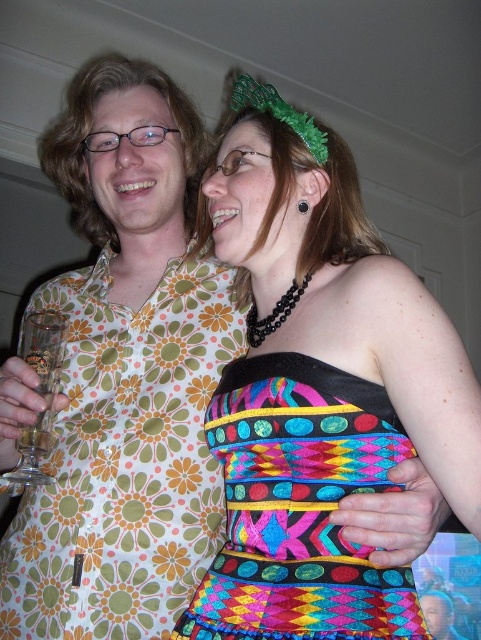
Question: Estimate the real-world distances between objects in this image. Which object is farther from the multicolored fabric dress at center?

Choices:
 (A) multicolored woven dress at center
 (B) floral-patterned shirt at center
 (C) clear glass wine glass at left

Answer: (C)

Question: Is multicolored fabric dress at center bigger than multicolored woven dress at center?

Choices:
 (A) yes
 (B) no

Answer: (A)

Question: Is multicolored fabric dress at center closer to the viewer compared to clear glass wine glass at left?

Choices:
 (A) no
 (B) yes

Answer: (B)

Question: Which of the following is the closest to the observer?

Choices:
 (A) clear glass wine glass at left
 (B) multicolored woven dress at center

Answer: (B)

Question: Does floral-patterned shirt at center appear on the right side of clear glass wine glass at left?

Choices:
 (A) yes
 (B) no

Answer: (A)

Question: Which point is closer to the camera?

Choices:
 (A) (378, 428)
 (B) (37, 342)

Answer: (A)